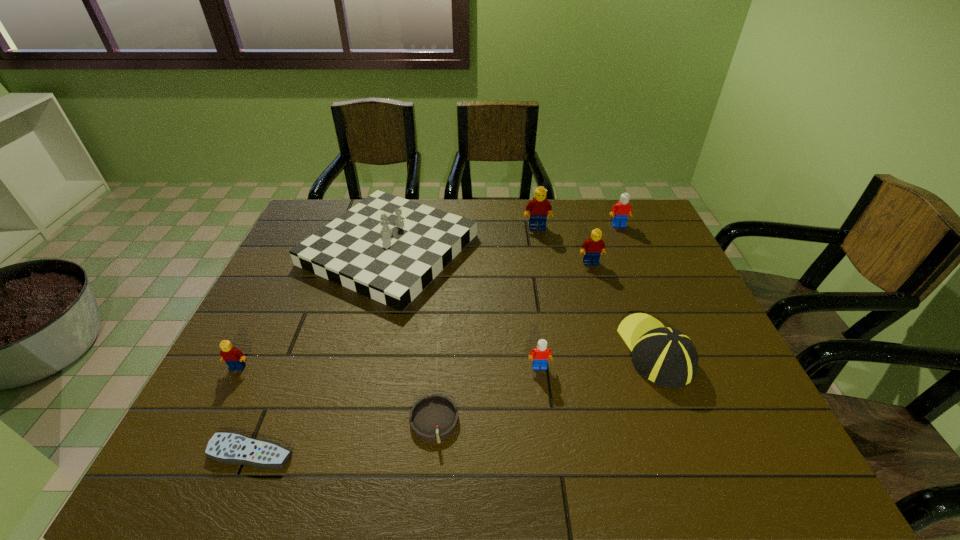
Find the location of a particular element. The height and width of the screenshot is (540, 960). object that is the fourth closest to the rightmost Lego is located at coordinates (387, 248).

Choose which Lego is the nearest neighbor to the left white Lego. Please provide its 2D coordinates. Your answer should be formatted as a tuple, i.e. [(x, y)], where the tuple contains the x and y coordinates of a point satisfying the conditions above.

[(592, 248)]

Identify the location of the second closest Lego to the farthest yellow Lego. (622, 210).

Identify which yellow Lego is the second closest to the gray ashtray. Please provide its 2D coordinates. Your answer should be formatted as a tuple, i.e. [(x, y)], where the tuple contains the x and y coordinates of a point satisfying the conditions above.

[(592, 248)]

Select which yellow Lego appears as the closest to the smallest yellow Lego. Please provide its 2D coordinates. Your answer should be formatted as a tuple, i.e. [(x, y)], where the tuple contains the x and y coordinates of a point satisfying the conditions above.

[(540, 208)]